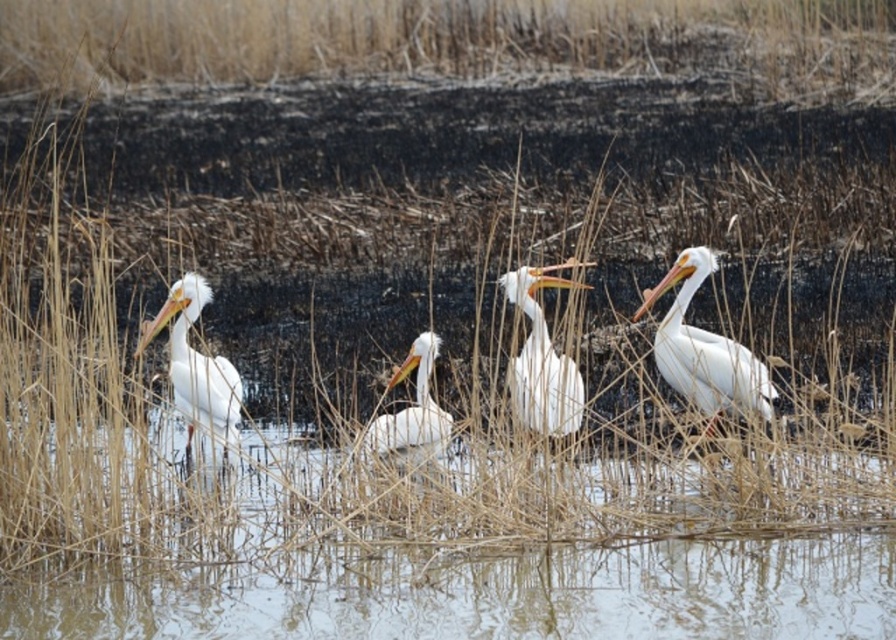
Question: Can you confirm if clear water at lower center is smaller than white matte pelican at right?

Choices:
 (A) no
 (B) yes

Answer: (A)

Question: Which of the following is the farthest from the observer?

Choices:
 (A) clear water at lower center
 (B) white matte pelican at left
 (C) white matte pelican at center

Answer: (C)

Question: Does clear water at lower center have a greater width compared to white matte pelican at right?

Choices:
 (A) yes
 (B) no

Answer: (A)

Question: Which point is closer to the camera?

Choices:
 (A) clear water at lower center
 (B) white smooth pelican at center
 (C) white matte pelican at center
 (D) white matte pelican at left

Answer: (A)

Question: Which object is closer to the camera taking this photo?

Choices:
 (A) white matte pelican at center
 (B) white matte pelican at right

Answer: (A)

Question: Considering the relative positions of white smooth pelican at center and white matte pelican at left in the image provided, where is white smooth pelican at center located with respect to white matte pelican at left?

Choices:
 (A) below
 (B) above

Answer: (B)